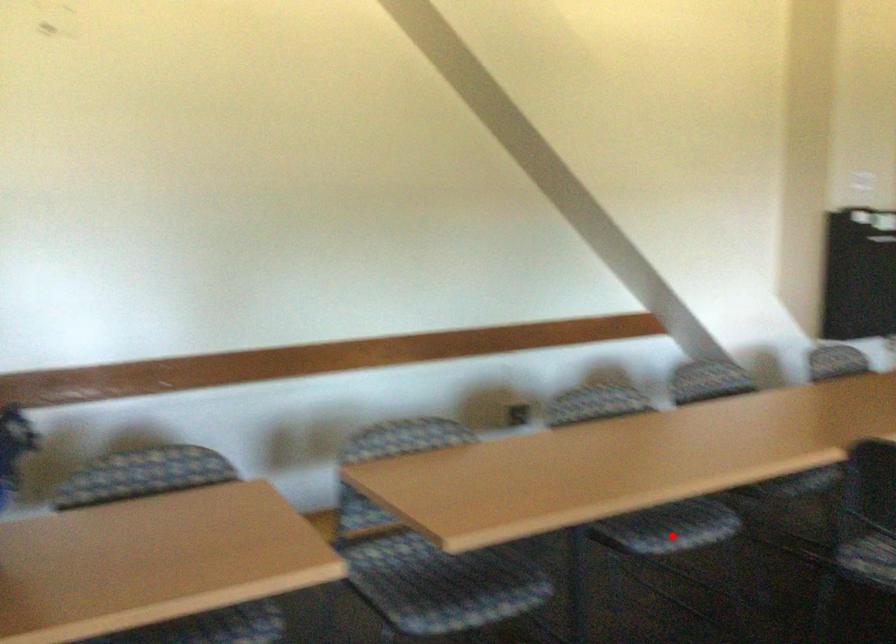
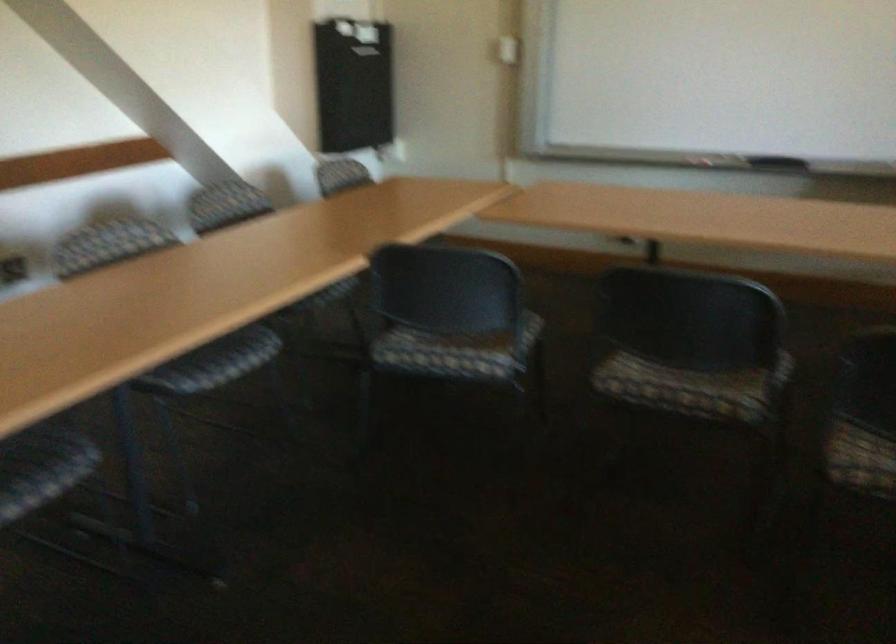
In the second image, find the point that corresponds to the highlighted location in the first image.

(219, 366)